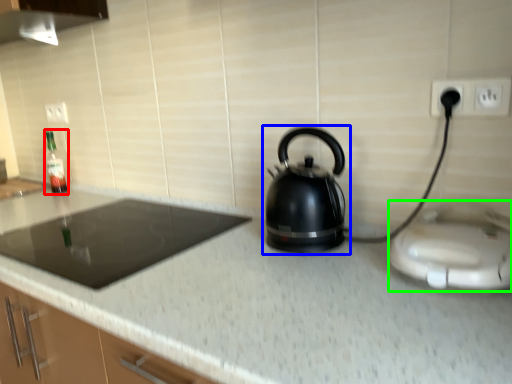
Question: Based on their relative distances, which object is farther from bottle (highlighted by a red box)? Choose from kettle (highlighted by a blue box) and appliance (highlighted by a green box).

Choices:
 (A) kettle
 (B) appliance

Answer: (B)